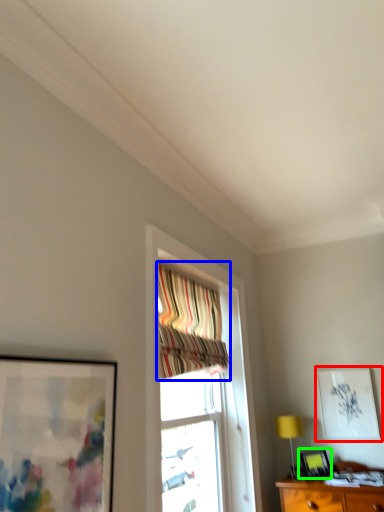
Question: Estimate the real-world distances between objects in this image. Which object is closer to picture frame (highlighted by a red box), curtain (highlighted by a blue box) or picture frame (highlighted by a green box)?

Choices:
 (A) curtain
 (B) picture frame

Answer: (B)